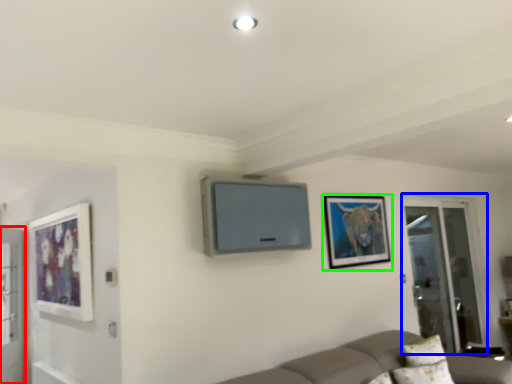
Question: Considering the real-world distances, which object is closest to screen door (highlighted by a red box)? screen door (highlighted by a blue box) or picture frame (highlighted by a green box).

Choices:
 (A) screen door
 (B) picture frame

Answer: (B)